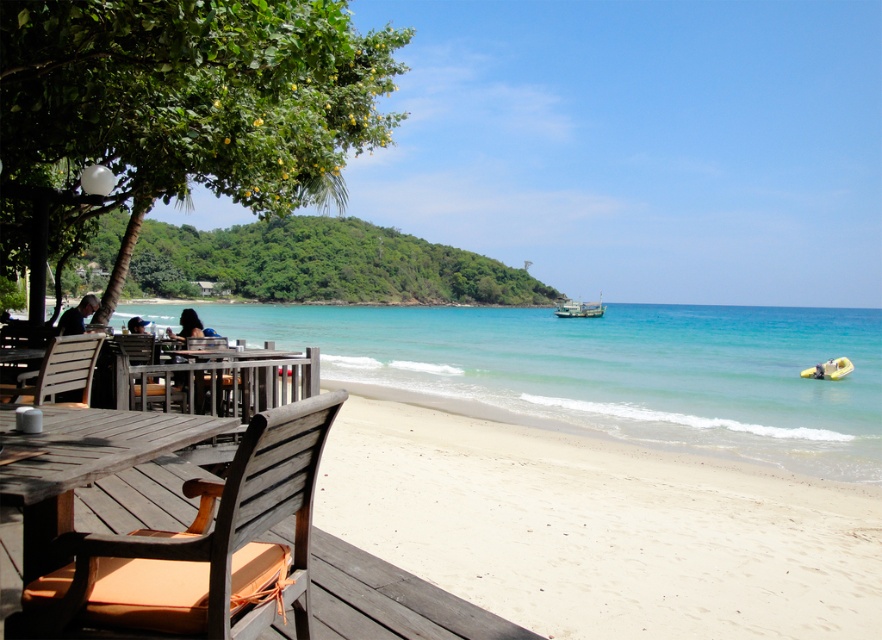
Between wooden table at lower left and wooden chair at center, which one has more height?

wooden chair at center

Is wooden table at lower left closer to the viewer compared to wooden chair at center?

Yes, it is in front of wooden chair at center.

Which is behind, point (141, 451) or point (219, 342)?

The point (219, 342) is behind.

At what (x,y) coordinates should I click in order to perform the action: click on wooden table at lower left. Please return your answer as a coordinate pair (x, y). The image size is (882, 640). Looking at the image, I should click on (81, 461).

Is wooden textured chair at lower left positioned before wooden chair at left?

Yes, wooden textured chair at lower left is closer to the viewer.

How distant is wooden textured chair at lower left from wooden chair at left?

wooden textured chair at lower left and wooden chair at left are 6.28 feet apart from each other.

The image size is (882, 640). Find the location of `wooden textured chair at lower left`. wooden textured chair at lower left is located at coordinates (203, 545).

Is clear blue water at center positioned behind wooden textured chair at lower left?

Yes, clear blue water at center is behind wooden textured chair at lower left.

Is point (853, 314) in front of point (136, 532)?

No.

Does point (768, 400) come farther from viewer compared to point (57, 602)?

Yes, it is behind point (57, 602).

Find the location of a particular element. The image size is (882, 640). clear blue water at center is located at coordinates (615, 371).